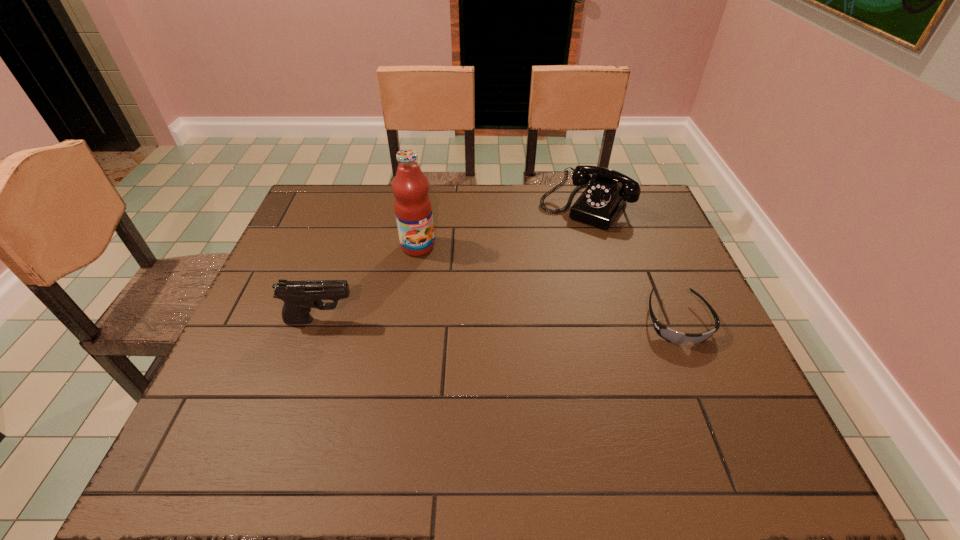
The image size is (960, 540). In order to click on the leftmost object in this screenshot , I will do `click(299, 297)`.

The height and width of the screenshot is (540, 960). Identify the location of the shortest object. (670, 335).

This screenshot has height=540, width=960. In order to click on the second farthest object in this screenshot , I will do `click(413, 209)`.

At what (x,y) coordinates should I click in order to perform the action: click on the second object from left to right. Please return your answer as a coordinate pair (x, y). The image size is (960, 540). Looking at the image, I should click on (413, 209).

Find the location of a particular element. telephone is located at coordinates (600, 203).

Where is `free location located 0.050m at the barrel of the pistol`? This screenshot has width=960, height=540. free location located 0.050m at the barrel of the pistol is located at coordinates (377, 320).

Identify the location of free spot located on the front label of the tallest object. (494, 352).

At what (x,y) coordinates should I click in order to perform the action: click on vacant space located 0.150m on the front label of the tallest object. Please return your answer as a coordinate pair (x, y). Looking at the image, I should click on click(449, 289).

In order to click on blank space located 0.330m on the front label of the tallest object in this screenshot , I will do pyautogui.click(x=484, y=337).

The height and width of the screenshot is (540, 960). Identify the location of vacant position located on the dial of the telephone. (533, 273).